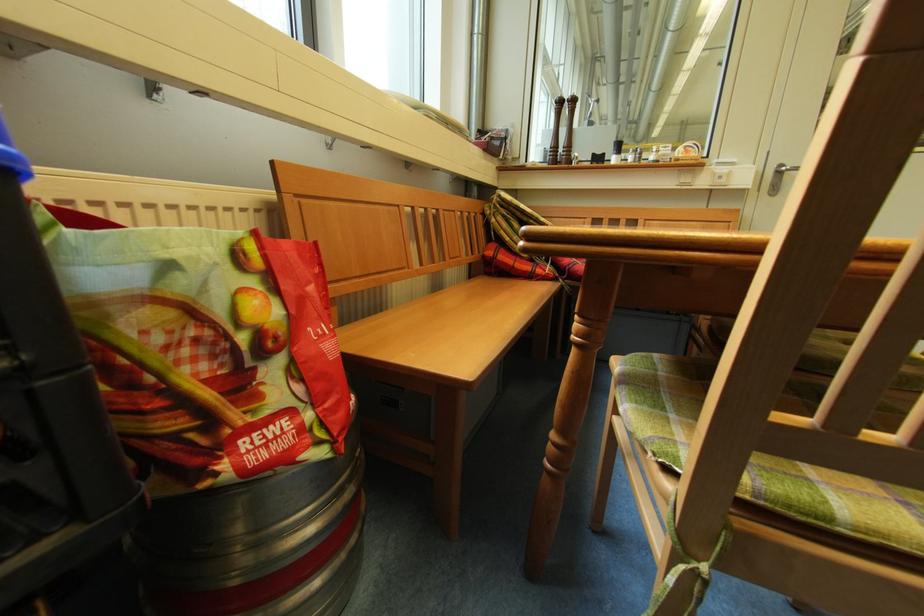
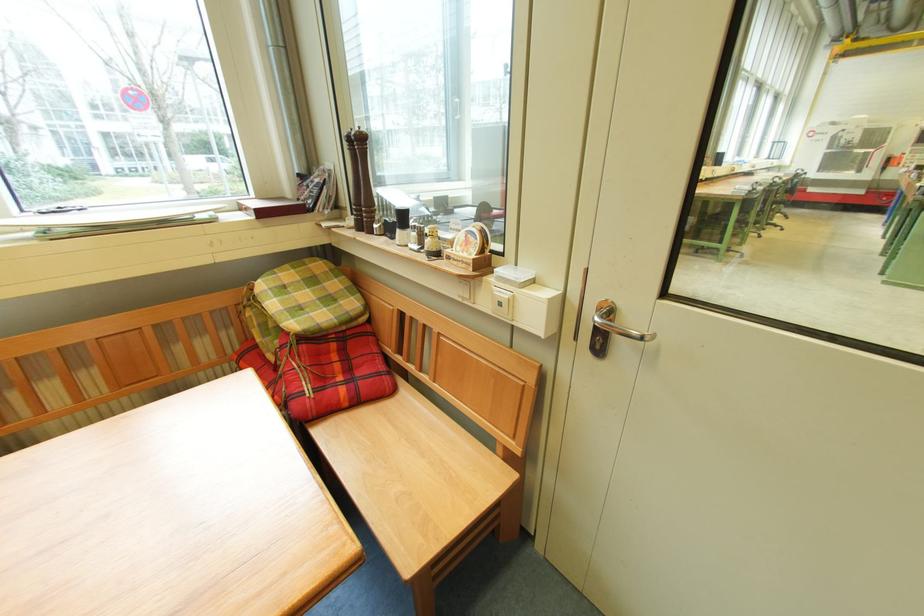
Where in the second image is the point corresponding to point (727, 180) from the first image?

(507, 307)